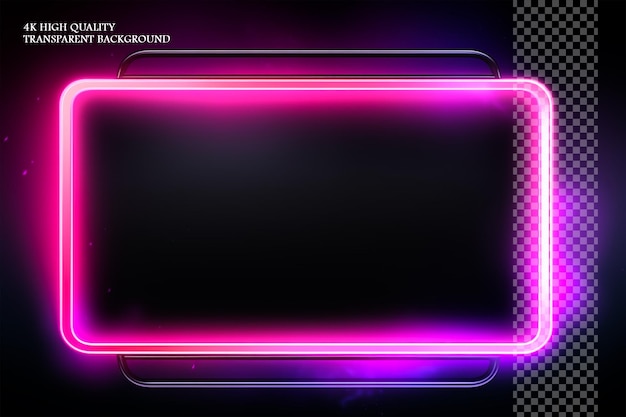
Where is `neon light border`? Image resolution: width=626 pixels, height=417 pixels. neon light border is located at coordinates (121, 84), (345, 84), (530, 87), (544, 205), (473, 350), (196, 348), (67, 247).